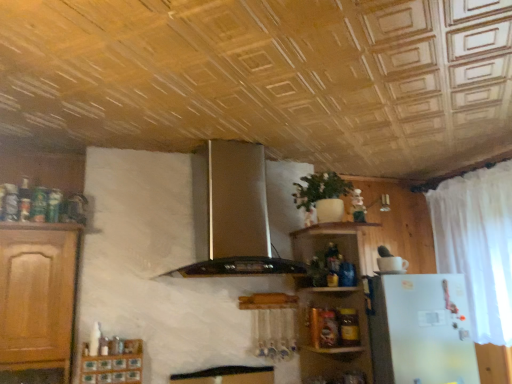
Where is `free space above satin silver exhaust hood at center (from a real-world perspective)`? free space above satin silver exhaust hood at center (from a real-world perspective) is located at coordinates (232, 135).